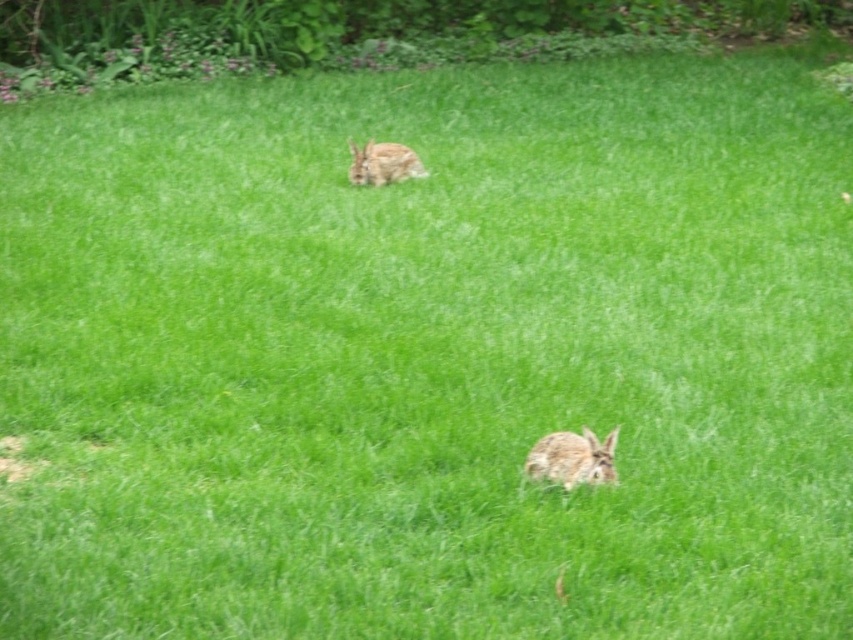
Who is positioned more to the right, fuzzy brown rabbit at lower center or fuzzy brown rabbit at upper center?

From the viewer's perspective, fuzzy brown rabbit at lower center appears more on the right side.

Which is above, fuzzy brown rabbit at lower center or fuzzy brown rabbit at upper center?

fuzzy brown rabbit at upper center

Where is `fuzzy brown rabbit at lower center`? The width and height of the screenshot is (853, 640). fuzzy brown rabbit at lower center is located at coordinates (572, 458).